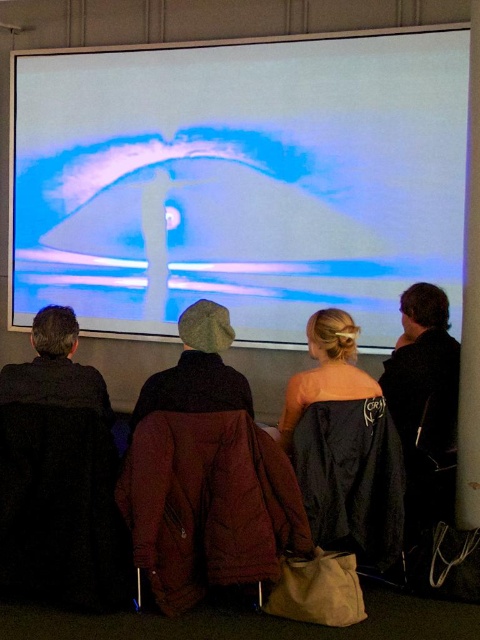
Is white glossy projection screen at upper center below black fuzzy hat at left?

Actually, white glossy projection screen at upper center is above black fuzzy hat at left.

Between white glossy projection screen at upper center and black fuzzy hat at left, which one is positioned higher?

white glossy projection screen at upper center is above.

Who is more forward, (175, 236) or (39, 340)?

Point (39, 340) is more forward.

Identify the location of white glossy projection screen at upper center. (240, 180).

Who is taller, white glossy projection screen at upper center or black satin dress at center?

Standing taller between the two is white glossy projection screen at upper center.

What do you see at coordinates (240, 180) in the screenshot?
I see `white glossy projection screen at upper center` at bounding box center [240, 180].

This screenshot has width=480, height=640. I want to click on white glossy projection screen at upper center, so click(x=240, y=180).

Is point (457, 97) less distant than point (205, 355)?

No, it is not.

Between white glossy projection screen at upper center and brown woolen hat at center, which one has less height?

Standing shorter between the two is brown woolen hat at center.

Is point (255, 260) closer to viewer compared to point (147, 381)?

No, (255, 260) is behind (147, 381).

Image resolution: width=480 pixels, height=640 pixels. Find the location of `white glossy projection screen at upper center`. white glossy projection screen at upper center is located at coordinates (240, 180).